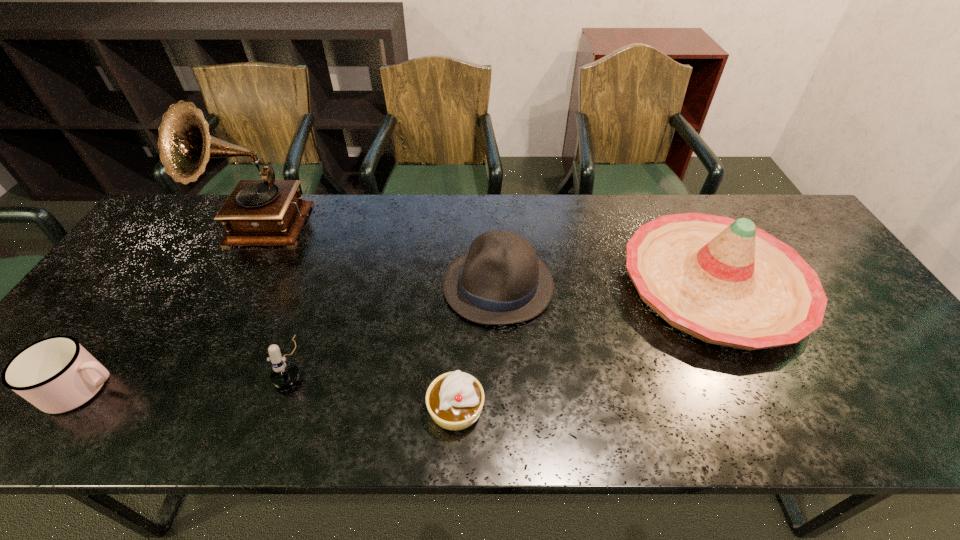
At what (x,y) coordinates should I click in order to perform the action: click on the tallest object. Please return your answer as a coordinate pair (x, y). This screenshot has height=540, width=960. Looking at the image, I should click on 268,212.

You are a GUI agent. You are given a task and a screenshot of the screen. Output one action in this format:
    pyautogui.click(x=<x>, y=<y>)
    Task: Click on the second tallest object
    This screenshot has height=540, width=960.
    Given the screenshot: What is the action you would take?
    pyautogui.click(x=724, y=281)

Image resolution: width=960 pixels, height=540 pixels. Find the location of `the rightmost object`. the rightmost object is located at coordinates (724, 281).

Find the location of `the third tallest object`. the third tallest object is located at coordinates (500, 281).

This screenshot has width=960, height=540. Find the location of `microphone`. microphone is located at coordinates (284, 374).

I want to click on mug, so click(56, 374).

Find the location of a particular element. This screenshot has height=540, width=960. the shortest object is located at coordinates (454, 400).

This screenshot has width=960, height=540. In order to click on vacant area located on the horn of the tallest object in this screenshot , I will do `click(180, 378)`.

This screenshot has height=540, width=960. What are the coordinates of `free space located on the front of the fifth shortest object` in the screenshot? It's located at (781, 424).

The image size is (960, 540). What are the coordinates of `free space located on the front-facing side of the bowler hat` in the screenshot? It's located at (347, 285).